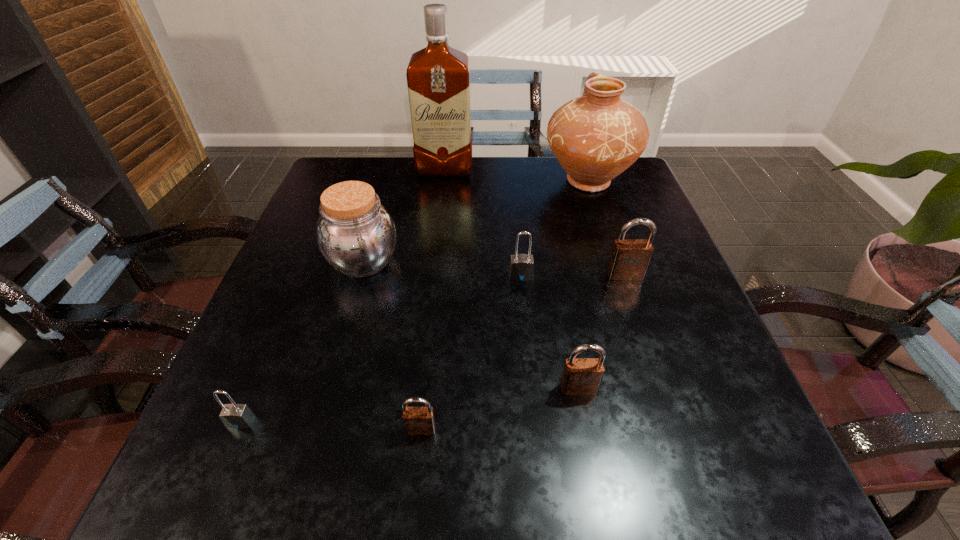
Where is `pottery that is at the far edge`? pottery that is at the far edge is located at coordinates (595, 137).

I want to click on jar located at the left edge, so click(356, 234).

Where is `padlock that is positioned at the left edge`? The image size is (960, 540). padlock that is positioned at the left edge is located at coordinates (237, 416).

Image resolution: width=960 pixels, height=540 pixels. What are the coordinates of `pottery situated at the right edge` in the screenshot? It's located at (595, 137).

At what (x,y) coordinates should I click in order to perform the action: click on padlock that is at the right edge. Please return your answer as a coordinate pair (x, y). The width and height of the screenshot is (960, 540). Looking at the image, I should click on (630, 258).

Locate an element on the screen. The image size is (960, 540). object at the far right corner is located at coordinates (595, 137).

Where is `vacant area at the far edge of the desktop`? vacant area at the far edge of the desktop is located at coordinates (384, 187).

You are a GUI agent. You are given a task and a screenshot of the screen. Output one action in this format:
    pyautogui.click(x=<x>, y=<y>)
    Task: Click on the free space at the near edge of the desktop
    The height and width of the screenshot is (540, 960).
    Given the screenshot: What is the action you would take?
    pyautogui.click(x=491, y=467)

In the image, there is a desktop. Identify the location of free space at the left edge. The image size is (960, 540). (231, 397).

Locate an element on the screen. This screenshot has height=540, width=960. free space at the right edge of the desktop is located at coordinates coord(599,208).